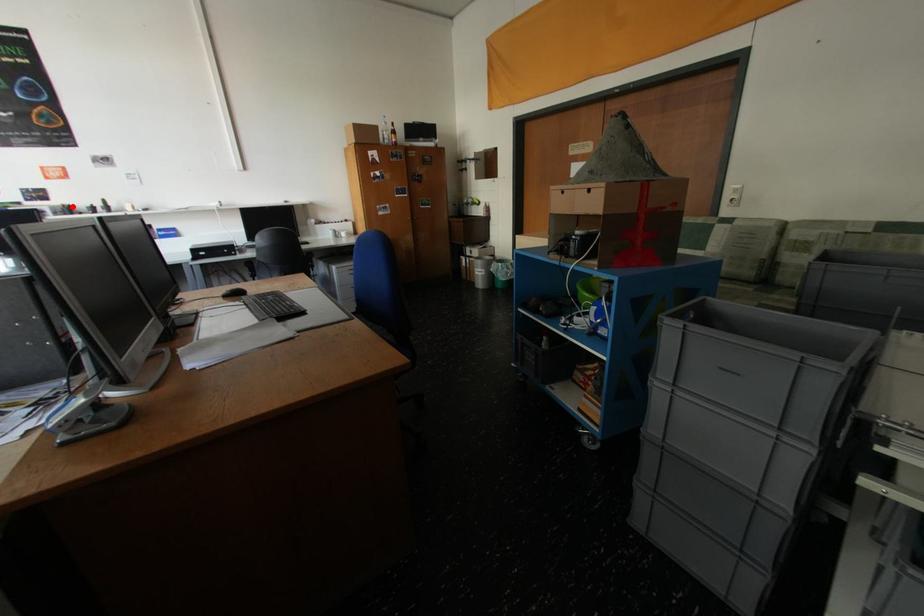
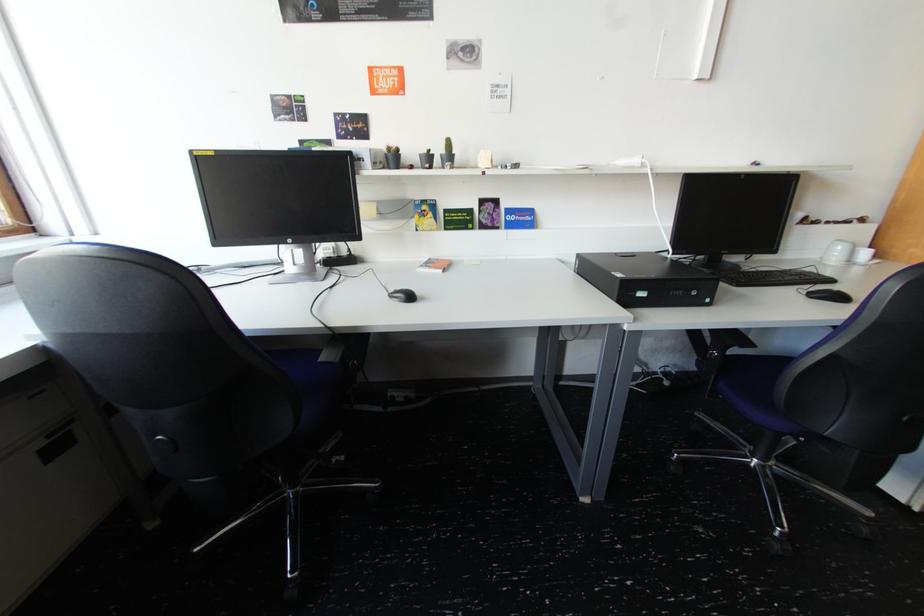
Question: I am providing you with two images of the same scene from different viewpoints. Given a red point in image1, look at the same physical point in image2. Is it:

Choices:
 (A) Closer to the viewpoint
 (B) Farther from the viewpoint

Answer: (A)